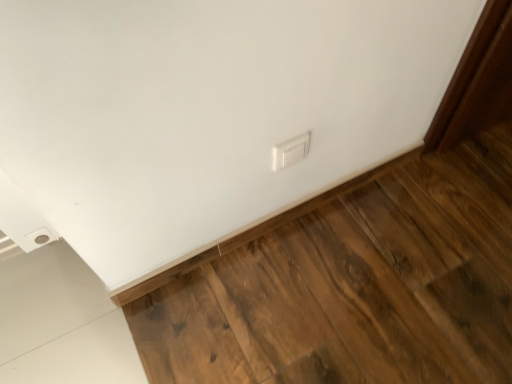
Locate an element on the screen. brown wood flooring at lower right is located at coordinates [x=355, y=287].

Measure the distance between brown wood flooring at lower right and camera.

86.13 centimeters.

This screenshot has height=384, width=512. Describe the element at coordinates (355, 287) in the screenshot. I see `brown wood flooring at lower right` at that location.

Image resolution: width=512 pixels, height=384 pixels. I want to click on white plastic switch at center, so click(290, 151).

The height and width of the screenshot is (384, 512). Describe the element at coordinates (290, 151) in the screenshot. I see `white plastic switch at center` at that location.

Where is `brown wood flooring at lower right`? brown wood flooring at lower right is located at coordinates pyautogui.click(x=355, y=287).

Considering the positions of objects white plastic switch at center and brown wood flooring at lower right in the image provided, who is more to the left, white plastic switch at center or brown wood flooring at lower right?

brown wood flooring at lower right is more to the left.

Which object is closer to the camera taking this photo, white plastic switch at center or brown wood flooring at lower right?

brown wood flooring at lower right.

Is point (293, 141) positioned after point (394, 334)?

No.

From the image's perspective, which one is positioned lower, white plastic switch at center or brown wood flooring at lower right?

From the image's view, brown wood flooring at lower right is below.

From a real-world perspective, is white plastic switch at center on top of brown wood flooring at lower right?

Correct, in the physical world, white plastic switch at center is higher than brown wood flooring at lower right.

Which of these two, white plastic switch at center or brown wood flooring at lower right, is thinner?

white plastic switch at center.

Does white plastic switch at center have a greater height compared to brown wood flooring at lower right?

Correct, white plastic switch at center is much taller as brown wood flooring at lower right.

Looking at this image, is white plastic switch at center bigger than brown wood flooring at lower right?

Actually, white plastic switch at center might be smaller than brown wood flooring at lower right.

Is white plastic switch at center surrounding brown wood flooring at lower right?

No, brown wood flooring at lower right is not a part of white plastic switch at center.

Are white plastic switch at center and brown wood flooring at lower right located far from each other?

They are positioned close to each other.

Is white plastic switch at center looking in the opposite direction of brown wood flooring at lower right?

No, brown wood flooring at lower right is not at the back of white plastic switch at center.

Locate an element on the screen. The height and width of the screenshot is (384, 512). electric outlet above the brown wood flooring at lower right (from a real-world perspective) is located at coordinates (290, 151).

Does brown wood flooring at lower right appear on the left side of white plastic switch at center?

Correct, you'll find brown wood flooring at lower right to the left of white plastic switch at center.

Who is more distant, brown wood flooring at lower right or white plastic switch at center?

white plastic switch at center is more distant.

Considering the points (411, 166) and (274, 152), which point is in front, point (411, 166) or point (274, 152)?

The point (274, 152) is closer.

From the image's perspective, is brown wood flooring at lower right under white plastic switch at center?

Correct, brown wood flooring at lower right appears lower than white plastic switch at center in the image.

From a real-world perspective, who is located lower, brown wood flooring at lower right or white plastic switch at center?

brown wood flooring at lower right.

Does brown wood flooring at lower right have a greater width compared to white plastic switch at center?

Yes, brown wood flooring at lower right is wider than white plastic switch at center.

Looking at this image, does brown wood flooring at lower right have a greater height compared to white plastic switch at center?

No, brown wood flooring at lower right is not taller than white plastic switch at center.

Who is bigger, brown wood flooring at lower right or white plastic switch at center?

Bigger between the two is brown wood flooring at lower right.

Is brown wood flooring at lower right situated inside white plastic switch at center or outside?

brown wood flooring at lower right is not enclosed by white plastic switch at center.

Would you say brown wood flooring at lower right is a long distance from white plastic switch at center?

No, brown wood flooring at lower right is in close proximity to white plastic switch at center.

Is brown wood flooring at lower right oriented away from white plastic switch at center?

brown wood flooring at lower right is not turned away from white plastic switch at center.

How many degrees apart are the facing directions of brown wood flooring at lower right and white plastic switch at center?

180 degrees.

How far apart are brown wood flooring at lower right and white plastic switch at center?

brown wood flooring at lower right is 15.54 inches from white plastic switch at center.

The image size is (512, 384). In the image, there is a brown wood flooring at lower right. In order to click on electric outlet above it (from the image's perspective) in this screenshot , I will do `click(290, 151)`.

You are a GUI agent. You are given a task and a screenshot of the screen. Output one action in this format:
    pyautogui.click(x=<x>, y=<y>)
    Task: Click on the electric outlet behind the brown wood flooring at lower right
    This screenshot has height=384, width=512.
    Given the screenshot: What is the action you would take?
    pyautogui.click(x=290, y=151)

Identify the location of hardwood below the white plastic switch at center (from the image's perspective). The height and width of the screenshot is (384, 512). (355, 287).